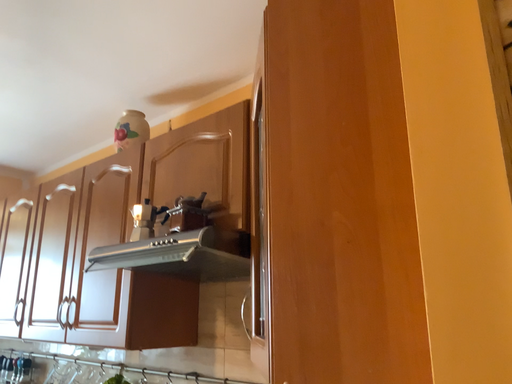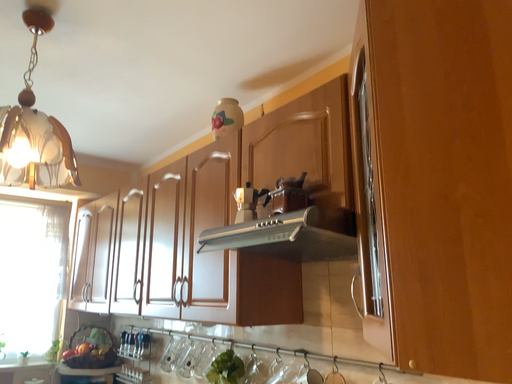
Question: Which way did the camera rotate in the video?

Choices:
 (A) rotated right
 (B) rotated left

Answer: (B)